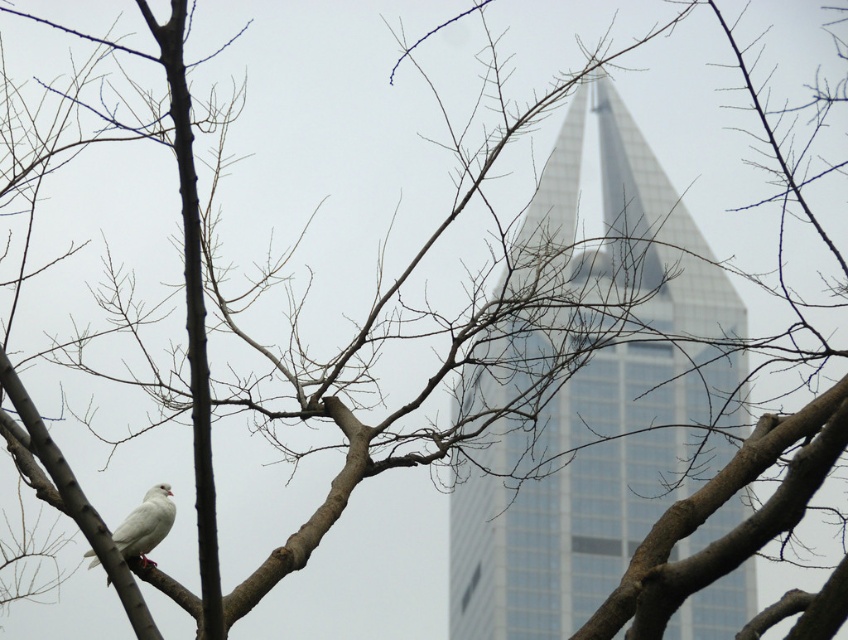
In the scene shown: Between glassy silver tower at center and brown rough tree branch at center, which one is positioned lower?

brown rough tree branch at center is lower down.

Where is `glassy silver tower at center`? glassy silver tower at center is located at coordinates (589, 390).

Is point (739, 372) in front of point (785, 422)?

No.

Locate an element on the screen. glassy silver tower at center is located at coordinates (589, 390).

Based on the photo, does brown rough tree branch at center appear on the right side of white matte bird at lower left?

Correct, you'll find brown rough tree branch at center to the right of white matte bird at lower left.

Is point (654, 557) behind point (160, 531)?

No, (654, 557) is in front of (160, 531).

Image resolution: width=848 pixels, height=640 pixels. Find the location of `brown rough tree branch at center`. brown rough tree branch at center is located at coordinates (718, 508).

In the scene shown: Between glassy silver tower at center and white matte bird at lower left, which one is positioned lower?

Positioned lower is white matte bird at lower left.

Locate an element on the screen. This screenshot has height=640, width=848. glassy silver tower at center is located at coordinates (589, 390).

Locate an element on the screen. This screenshot has width=848, height=640. glassy silver tower at center is located at coordinates (589, 390).